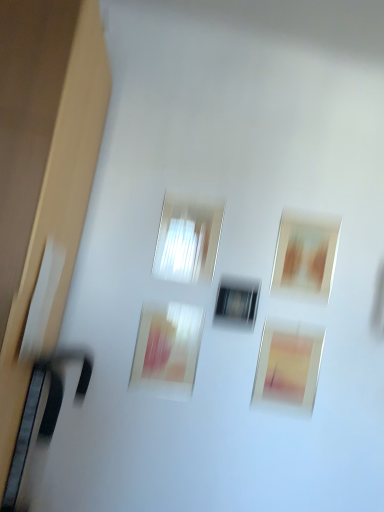
Question: Is the depth of matte pink picture frame at lower center, which is the 2th picture frame in left-to-right order, greater than that of matte brown picture frame at upper right, the 3th picture frame in the left-to-right sequence?

Choices:
 (A) no
 (B) yes

Answer: (A)

Question: Can you confirm if matte pink picture frame at lower center, which is the 2th picture frame in left-to-right order, is positioned to the left of matte brown picture frame at upper right, the 3th picture frame in the left-to-right sequence?

Choices:
 (A) yes
 (B) no

Answer: (A)

Question: Is matte brown picture frame at upper right, the 3th picture frame in the left-to-right sequence, located within matte pink picture frame at lower center, which is the second picture frame in right-to-left order?

Choices:
 (A) yes
 (B) no

Answer: (B)

Question: Is matte pink picture frame at lower center, which is the second picture frame in right-to-left order, smaller than matte brown picture frame at upper right, the 3th picture frame in the left-to-right sequence?

Choices:
 (A) yes
 (B) no

Answer: (B)

Question: From the image's perspective, is matte pink picture frame at lower center, which is the 2th picture frame in left-to-right order, on matte brown picture frame at upper right, which ranks as the first picture frame in right-to-left order?

Choices:
 (A) no
 (B) yes

Answer: (A)

Question: Considering the relative sizes of matte pink picture frame at lower center, which is the 2th picture frame in left-to-right order, and matte brown picture frame at upper right, which ranks as the first picture frame in right-to-left order, in the image provided, is matte pink picture frame at lower center, which is the 2th picture frame in left-to-right order, thinner than matte brown picture frame at upper right, which ranks as the first picture frame in right-to-left order,?

Choices:
 (A) no
 (B) yes

Answer: (A)

Question: Is matte pink picture frame at lower center, which is the 2th picture frame in left-to-right order, positioned beyond the bounds of transparent glass window at center, which ranks as the first window in left-to-right order?

Choices:
 (A) no
 (B) yes

Answer: (B)

Question: Considering the relative sizes of matte pink picture frame at lower center, which is the second picture frame in right-to-left order, and transparent glass window at center, which ranks as the first window in left-to-right order, in the image provided, is matte pink picture frame at lower center, which is the second picture frame in right-to-left order, shorter than transparent glass window at center, which ranks as the first window in left-to-right order,?

Choices:
 (A) no
 (B) yes

Answer: (B)

Question: Can you confirm if matte pink picture frame at lower center, which is the 2th picture frame in left-to-right order, is bigger than transparent glass window at center, which is the second window in right-to-left order?

Choices:
 (A) yes
 (B) no

Answer: (B)

Question: Is matte pink picture frame at lower center, which is the 2th picture frame in left-to-right order, next to transparent glass window at center, which is the second window in right-to-left order?

Choices:
 (A) no
 (B) yes

Answer: (A)

Question: Is matte pink picture frame at lower center, which is the 2th picture frame in left-to-right order, positioned with its back to transparent glass window at center, which ranks as the first window in left-to-right order?

Choices:
 (A) yes
 (B) no

Answer: (B)

Question: From the image's perspective, is matte pink picture frame at lower center, which is the 2th picture frame in left-to-right order, under transparent glass window at center, arranged as the 1th window when viewed from the top?

Choices:
 (A) yes
 (B) no

Answer: (A)

Question: Is transparent glass window at center, which is the second window from bottom to top, in front of matte brown picture frame at upper right, which ranks as the first picture frame in right-to-left order?

Choices:
 (A) no
 (B) yes

Answer: (B)